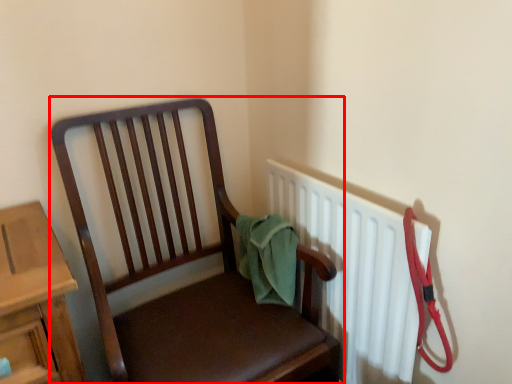
Question: Considering the relative positions of chair (annotated by the red box) and radiator in the image provided, where is chair (annotated by the red box) located with respect to the staircase?

Choices:
 (A) right
 (B) left

Answer: (B)